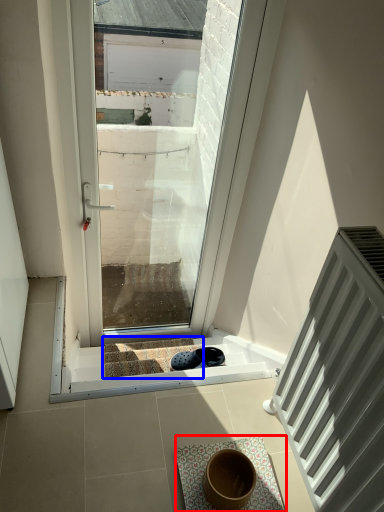
Question: Among these objects, which one is farthest to the camera, bath mat (highlighted by a red box) or stairwell (highlighted by a blue box)?

Choices:
 (A) bath mat
 (B) stairwell

Answer: (B)